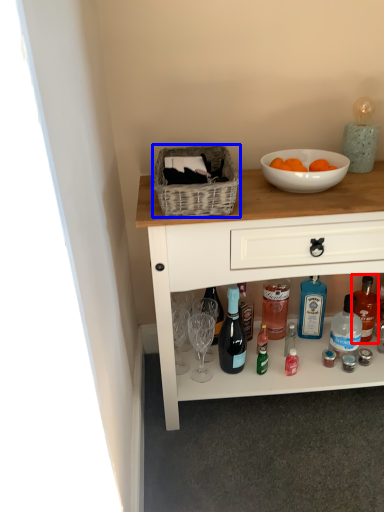
Question: Which object appears farthest to the camera in this image, bottle (highlighted by a red box) or picnic basket (highlighted by a blue box)?

Choices:
 (A) bottle
 (B) picnic basket

Answer: (A)